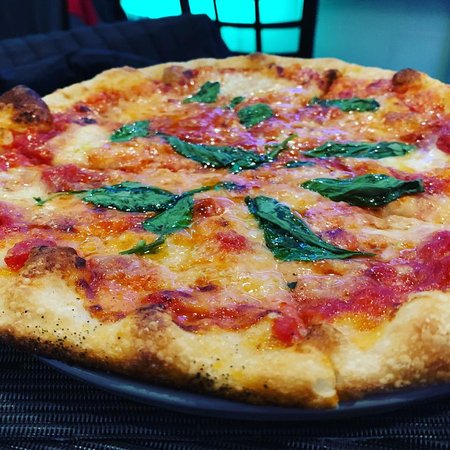
I want to click on plate, so click(x=154, y=395), click(x=249, y=405), click(x=390, y=403).